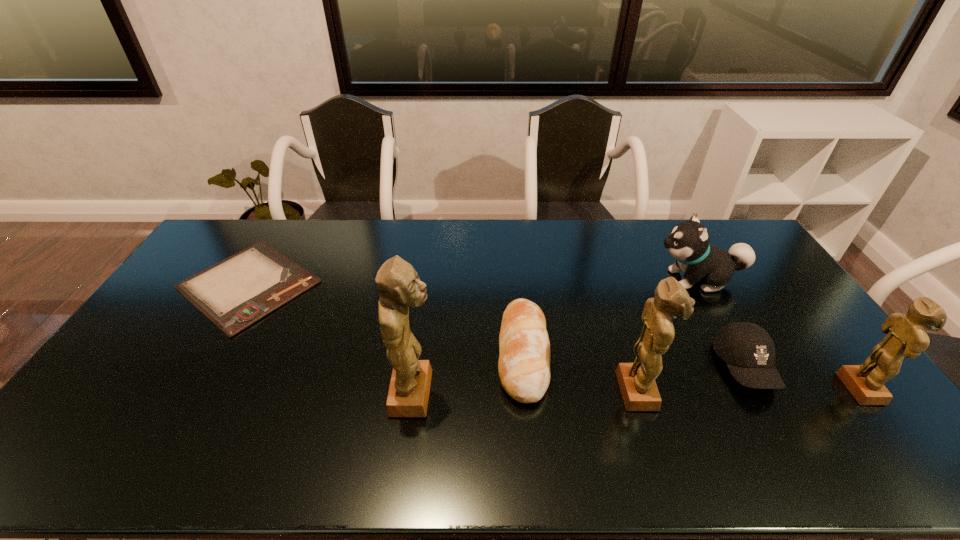
Please point a vacant point for placing a figurine on the left. Please provide its 2D coordinates. Your answer should be formatted as a tuple, i.e. [(x, y)], where the tuple contains the x and y coordinates of a point satisfying the conditions above.

[(187, 395)]